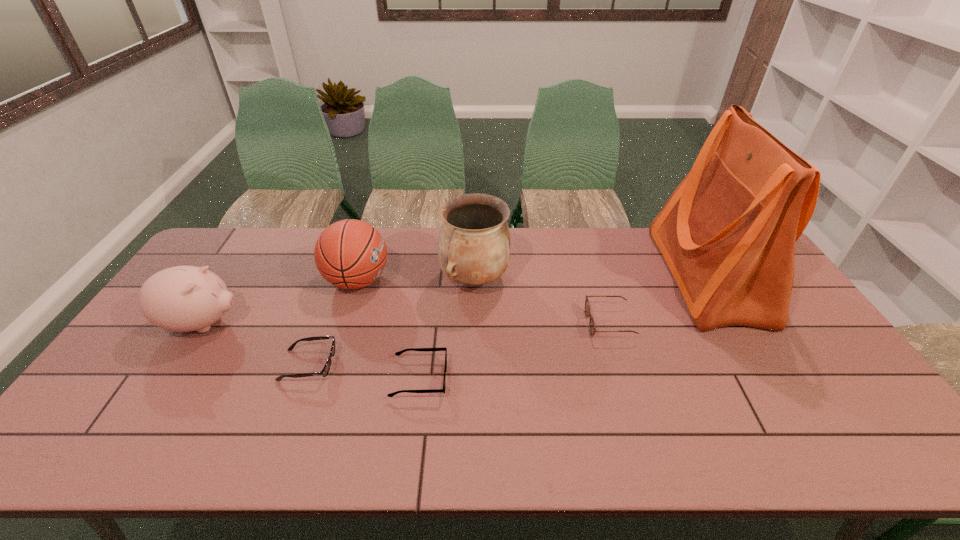
The width and height of the screenshot is (960, 540). I want to click on the tallest object, so click(x=727, y=233).

Locate an element on the screen. The width and height of the screenshot is (960, 540). the rightmost object is located at coordinates (727, 233).

This screenshot has width=960, height=540. In order to click on urn in this screenshot , I will do (473, 245).

Where is `basketball`? basketball is located at coordinates (351, 254).

Find the location of `the leftmost object`. the leftmost object is located at coordinates (183, 298).

Find the location of a particular element. Image resolution: width=960 pixels, height=540 pixels. the sixth object from left to right is located at coordinates (592, 328).

At what (x,y) coordinates should I click in order to perform the action: click on the rightmost spectacles. Please return your answer as a coordinate pair (x, y). Looking at the image, I should click on (592, 328).

In order to click on the leftmost spectacles in this screenshot , I will do `click(326, 369)`.

Find the location of a particular element. This screenshot has width=960, height=540. the second spectacles from right to left is located at coordinates (399, 353).

Find the location of a particular element. The height and width of the screenshot is (540, 960). free space located 0.390m on the front pocket of the tallest object is located at coordinates (543, 276).